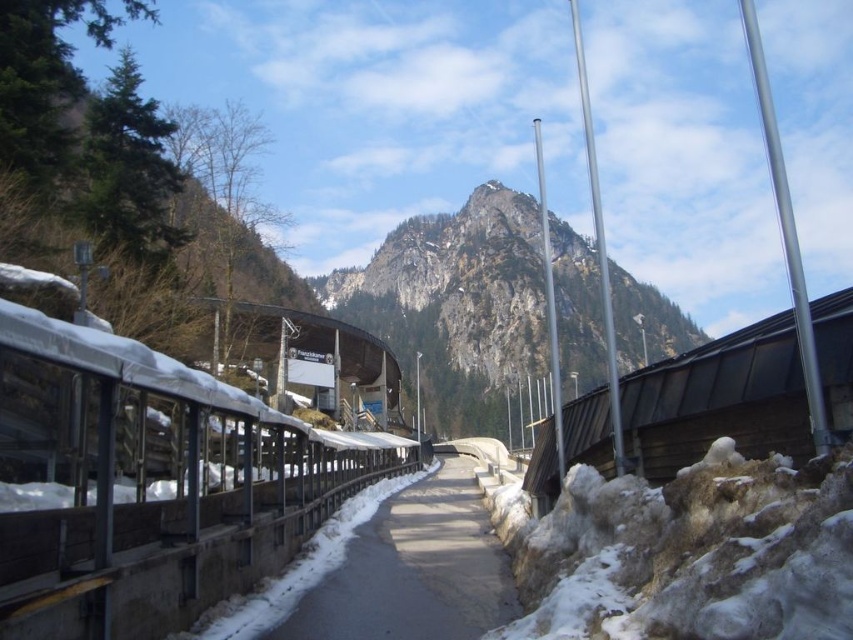
Question: Does smooth asphalt path at center have a lesser width compared to wooden signboard at center?

Choices:
 (A) no
 (B) yes

Answer: (B)

Question: Among these objects, which one is farthest from the camera?

Choices:
 (A) rugged stone mountain at center
 (B) wooden signboard at center

Answer: (A)

Question: Is rugged stone mountain at center below wooden signboard at center?

Choices:
 (A) no
 (B) yes

Answer: (A)

Question: Does rugged stone mountain at center lie in front of smooth asphalt path at center?

Choices:
 (A) no
 (B) yes

Answer: (A)

Question: Among these points, which one is nearest to the camera?

Choices:
 (A) (432, 525)
 (B) (521, 205)

Answer: (A)

Question: Considering the real-world distances, which object is closest to the wooden signboard at center?

Choices:
 (A) rugged stone mountain at center
 (B) smooth asphalt path at center

Answer: (B)